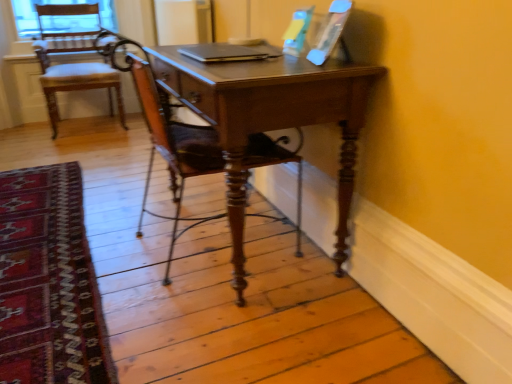
This screenshot has height=384, width=512. I want to click on vacant area that lies between wooden chair at left, marked as the second chair in a front-to-back arrangement, and carpet with intricate patterns at lower left, so click(89, 163).